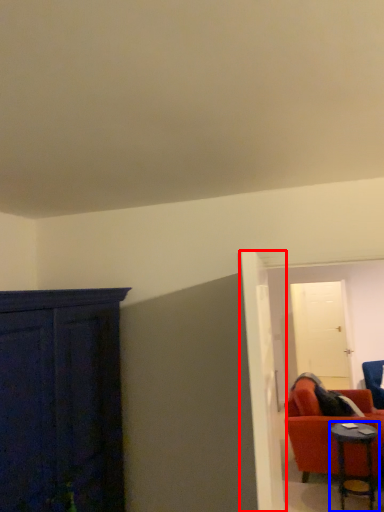
Question: Which object appears farthest to the camera in this image, door (highlighted by a red box) or table (highlighted by a blue box)?

Choices:
 (A) door
 (B) table

Answer: (B)